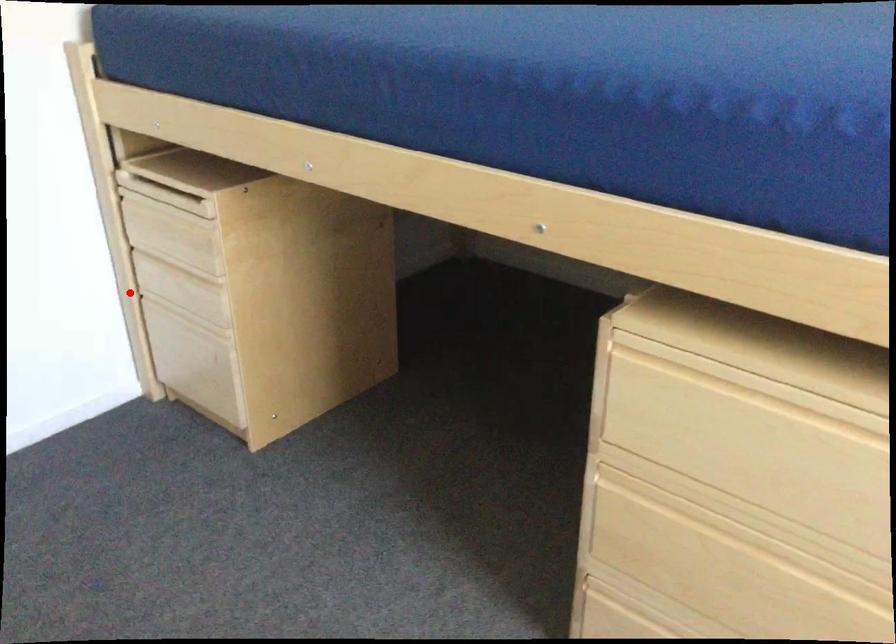
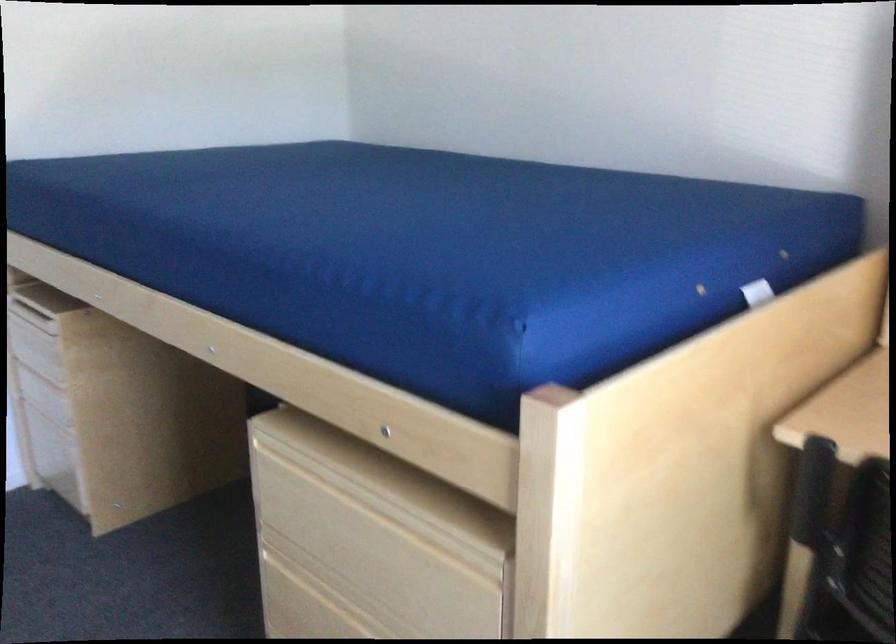
Locate, in the second image, the point that corresponds to the highlighted location in the first image.

(19, 395)